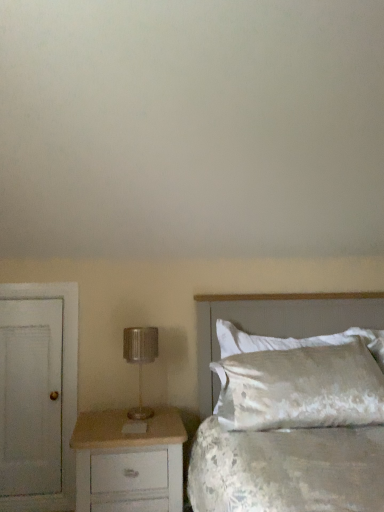
Identify the location of free space to the left of metallic silver lamp at left. This screenshot has height=512, width=384. (108, 417).